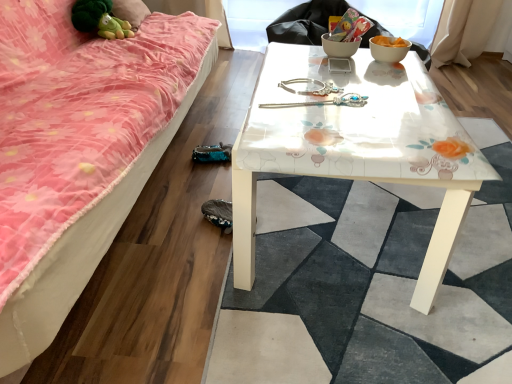
The width and height of the screenshot is (512, 384). I want to click on empty space that is ontop of white glossy table at center (from a real-world perspective), so click(x=364, y=91).